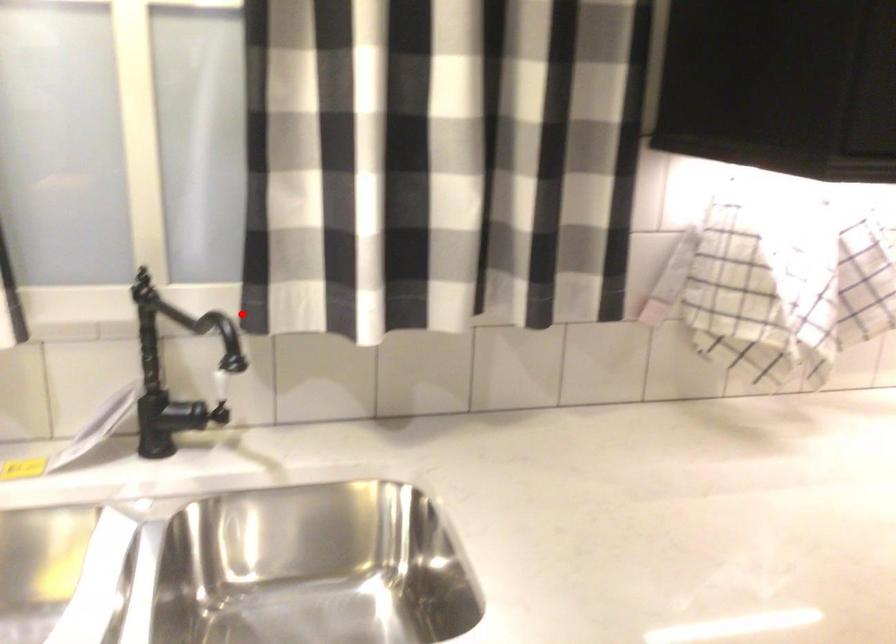
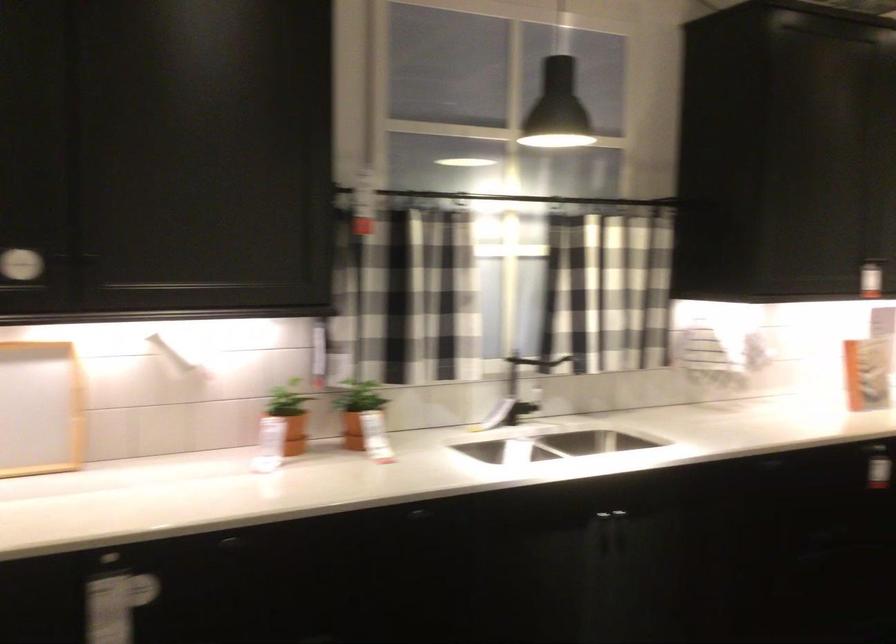
The point at the highlighted location is marked in the first image. Where is the corresponding point in the second image?

(538, 366)